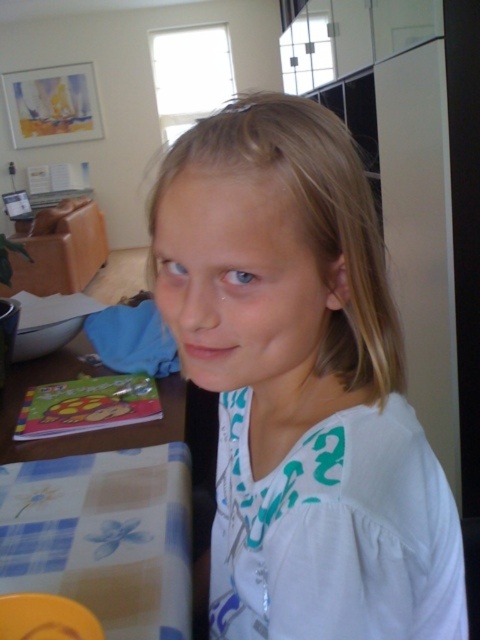
Question: Can you confirm if white cotton shirt at center is bigger than wooden table at lower left?

Choices:
 (A) yes
 (B) no

Answer: (A)

Question: Does white cotton shirt at center come in front of plaid fabric tablecloth at lower left?

Choices:
 (A) yes
 (B) no

Answer: (A)

Question: Is plaid fabric tablecloth at lower left to the right of wooden table at lower left from the viewer's perspective?

Choices:
 (A) no
 (B) yes

Answer: (B)

Question: Which of the following is the closest to the observer?

Choices:
 (A) (61, 579)
 (B) (24, 458)
 (C) (307, 154)

Answer: (C)

Question: Which object is positioned closest to the wooden table at lower left?

Choices:
 (A) white cotton shirt at center
 (B) plaid fabric tablecloth at lower left

Answer: (B)

Question: Which object appears farthest from the camera in this image?

Choices:
 (A) wooden table at lower left
 (B) white cotton shirt at center

Answer: (A)